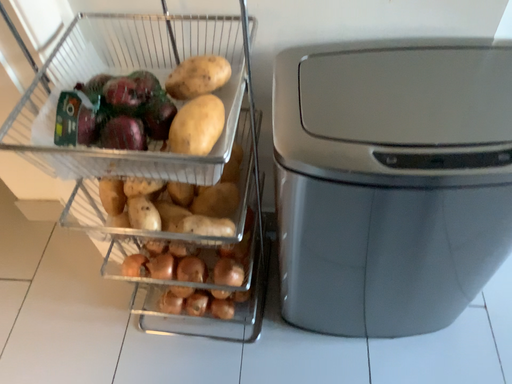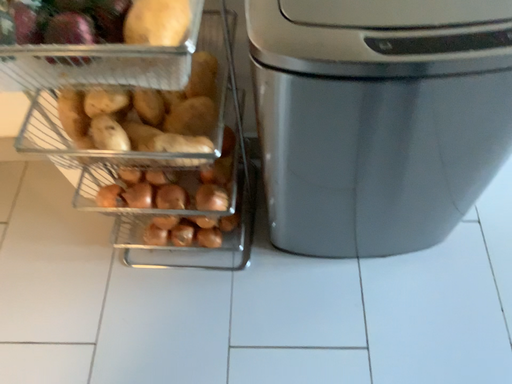
Question: How did the camera likely rotate when shooting the video?

Choices:
 (A) rotated downward
 (B) rotated upward

Answer: (A)